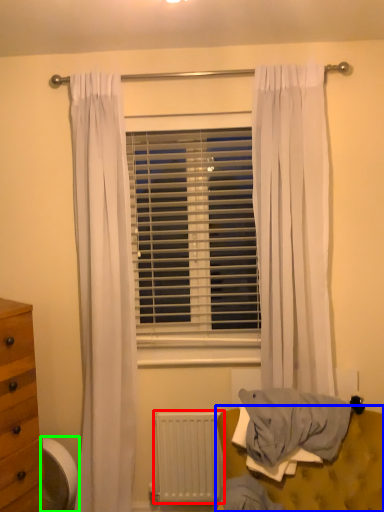
Question: Estimate the real-world distances between objects in this image. Which object is closer to radiator (highlighted by a red box), furniture (highlighted by a blue box) or swivel chair (highlighted by a green box)?

Choices:
 (A) furniture
 (B) swivel chair

Answer: (A)